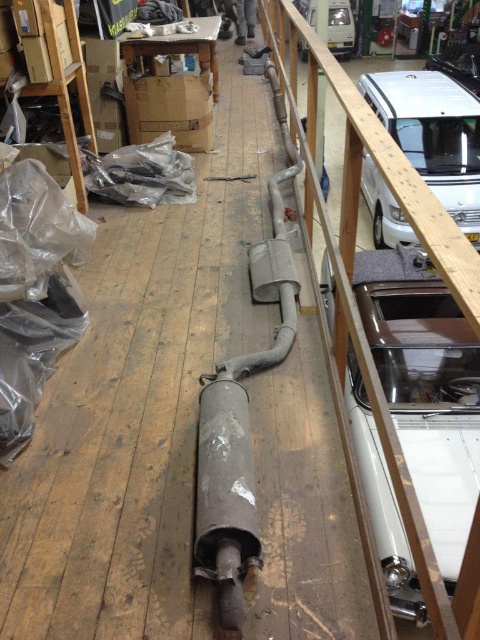
You are a mechanic working in the workshop. You need to move the silver metallic van at upper right closer to the wooden at upper right to access its engine. Is there enough space between them to maneuver the van safely?

The distance between the wooden at upper right and the silver metallic van at upper right is 4.10 meters. Since the van requires at least 3 meters of space to maneuver, there is sufficient space to move it closer safely.